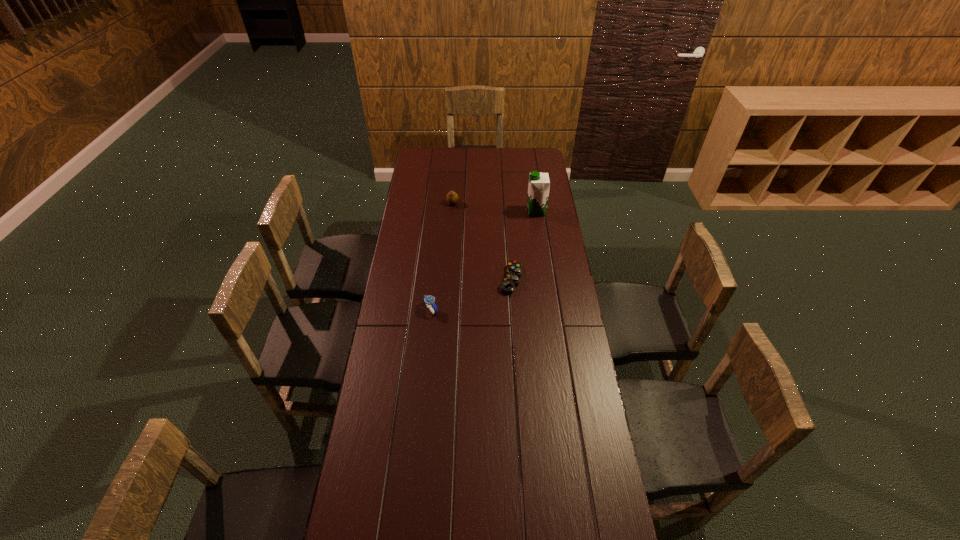
Locate an element on the screen. The width and height of the screenshot is (960, 540). vacant region located on the right of the pear is located at coordinates (491, 203).

Where is `vacant space located on the right of the second shortest object`? This screenshot has height=540, width=960. vacant space located on the right of the second shortest object is located at coordinates (510, 309).

I want to click on free location located 0.250m on the front of the second nearest object, so click(515, 342).

Identify the location of object located at the left edge. The height and width of the screenshot is (540, 960). (429, 300).

Image resolution: width=960 pixels, height=540 pixels. What are the coordinates of `object at the right edge` in the screenshot? It's located at (539, 184).

Locate an element on the screen. This screenshot has width=960, height=540. free location at the far edge is located at coordinates (512, 160).

Where is `free spot at the left edge of the desktop`? free spot at the left edge of the desktop is located at coordinates (403, 237).

This screenshot has width=960, height=540. In order to click on free space at the right edge in this screenshot , I will do `click(555, 326)`.

What are the coordinates of `vacant position at the far left corner of the desktop` in the screenshot? It's located at (437, 152).

Identify the location of vacant space that's between the pear and the tallest object. Image resolution: width=960 pixels, height=540 pixels. (494, 207).